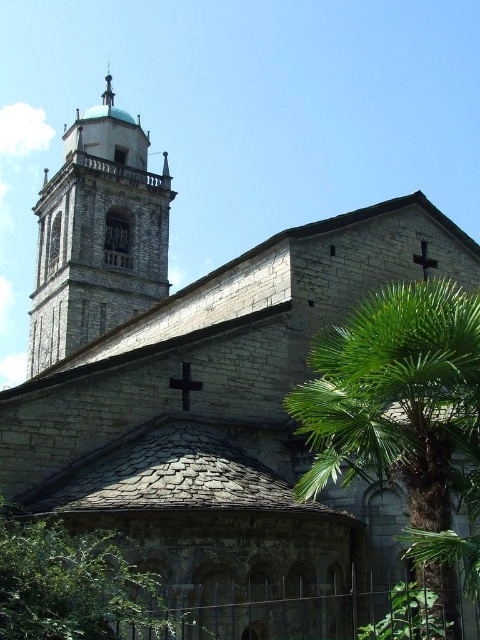
Does green leafy palm tree at right appear on the right side of gray stone tower at left?

Indeed, green leafy palm tree at right is positioned on the right side of gray stone tower at left.

Measure the distance between point (462,337) and camera.

Point (462,337) and camera are 28.20 meters apart from each other.

Locate an element on the screen. green leafy palm tree at right is located at coordinates (396, 397).

Between point (182, 400) and point (105, 88), which one is positioned behind?

The point (105, 88) is more distant.

Between point (183, 384) and point (110, 83), which one is positioned behind?

The point (110, 83) is more distant.

Identify the location of black stone cross at upper center. Image resolution: width=480 pixels, height=640 pixels. (184, 385).

Can you confirm if gray stone tower at left is thinner than green leafy tree at lower center?

No.

Which is above, gray stone tower at left or green leafy tree at lower center?

gray stone tower at left is higher up.

Is point (118, 216) more distant than point (37, 637)?

Yes, it is behind point (37, 637).

Find the location of a particular element. The height and width of the screenshot is (640, 480). gray stone tower at left is located at coordinates (97, 236).